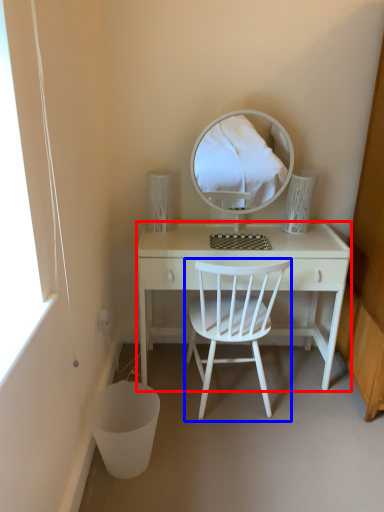
Question: Among these objects, which one is farthest to the camera, desk (highlighted by a red box) or chair (highlighted by a blue box)?

Choices:
 (A) desk
 (B) chair

Answer: (A)